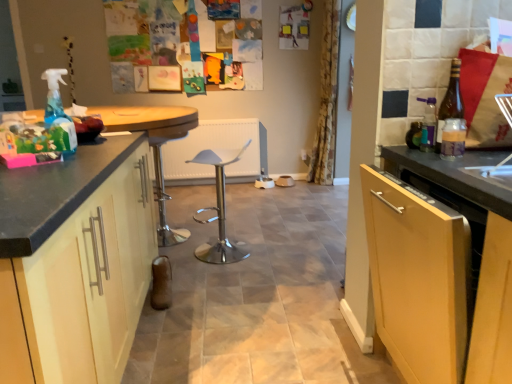
At what (x,y) coordinates should I click in order to perform the action: click on free location to the right of polished chrome bar stool at center, the 1th bar stool from the left. Please return your answer as a coordinate pair (x, y). The image size is (512, 384). Looking at the image, I should click on (203, 234).